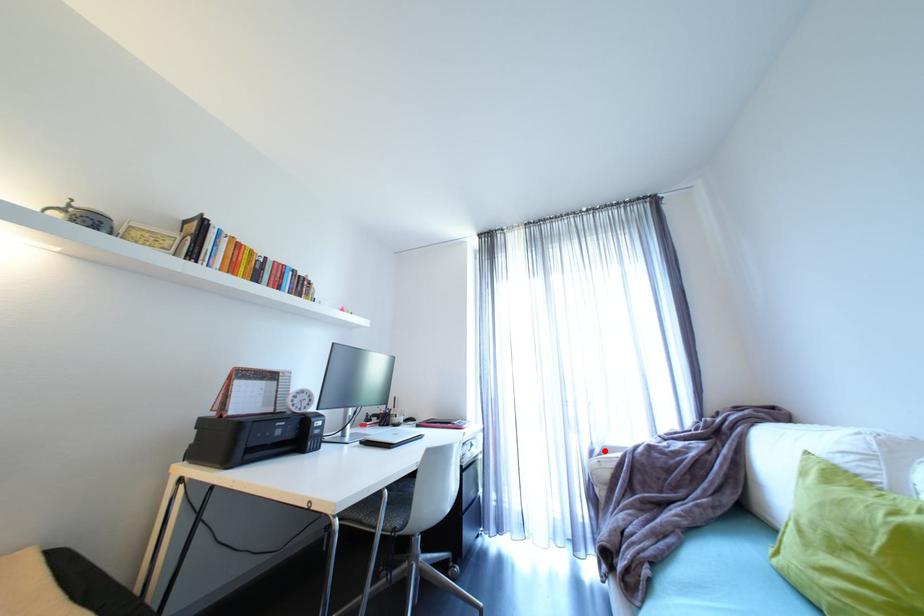
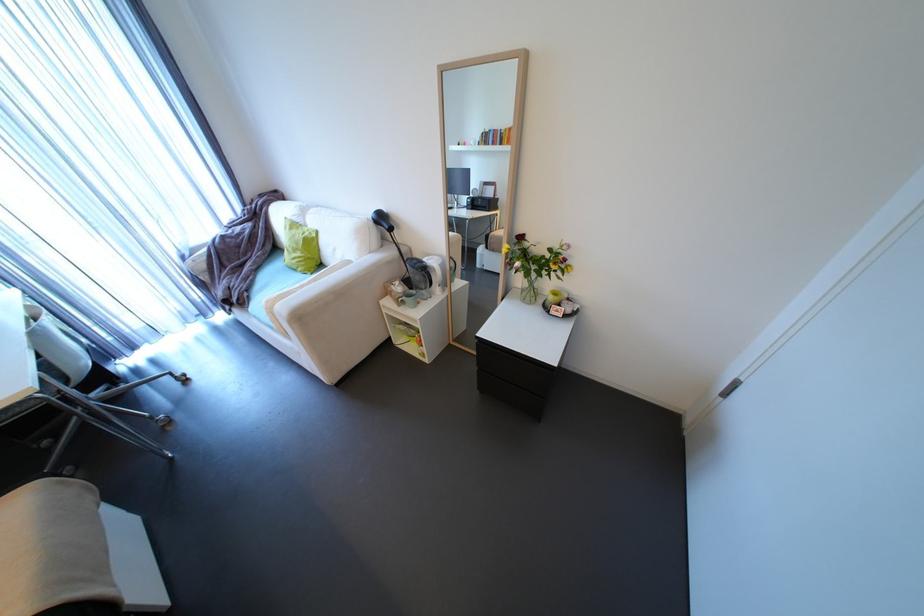
Find the pixel in the second image that matches the highlighted location in the first image.

(195, 254)